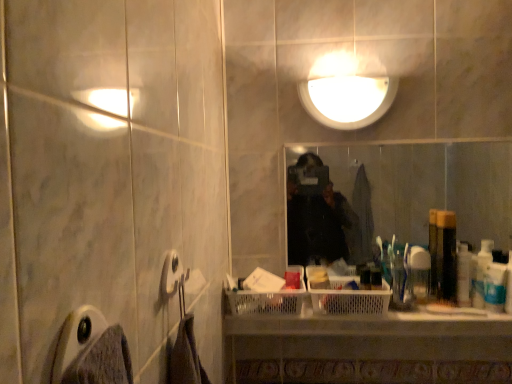
What is the approximate width of white plastic toothbrush at right, which is counted as the 4th toiletry, starting from the left?

The width of white plastic toothbrush at right, which is counted as the 4th toiletry, starting from the left, is 1.53 inches.

Describe the element at coordinates (419, 272) in the screenshot. The height and width of the screenshot is (384, 512). I see `clear plastic cup at right, the 5th toiletry in the right-to-left sequence` at that location.

You are a GUI agent. You are given a task and a screenshot of the screen. Output one action in this format:
    pyautogui.click(x=<x>, y=<y>)
    Task: Click on the clear plastic mirror at center
    The width and height of the screenshot is (512, 384).
    Given the screenshot: What is the action you would take?
    pyautogui.click(x=422, y=191)

Where is `translucent plastic bottle at right, which appears as the 4th toiletry when viewed from the right`? The image size is (512, 384). translucent plastic bottle at right, which appears as the 4th toiletry when viewed from the right is located at coordinates (446, 256).

Where is `the 4th toiletry in front of the clear plastic mirror at center`? This screenshot has height=384, width=512. the 4th toiletry in front of the clear plastic mirror at center is located at coordinates (495, 287).

Is the position of clear plastic mirror at center less distant than that of white plastic bottle at right, the fifth toiletry positioned from the left?

No, it is not.

Is clear plastic mirror at center far away from white plastic bottle at right, the fifth toiletry positioned from the left?

Indeed, clear plastic mirror at center is not near white plastic bottle at right, the fifth toiletry positioned from the left.

Which is correct: clear plastic mirror at center is inside white plastic bottle at right, the fifth toiletry positioned from the left, or outside of it?

clear plastic mirror at center is outside white plastic bottle at right, the fifth toiletry positioned from the left.

Looking at the image, does white plastic bottle at right, which is the first toiletry in right-to-left order, seem bigger or smaller compared to white glossy light fixture at upper center?

white plastic bottle at right, which is the first toiletry in right-to-left order, is smaller than white glossy light fixture at upper center.

I want to click on the 3rd toiletry in front of the white glossy light fixture at upper center, counting from the anchor's position, so click(x=495, y=287).

Can you confirm if white plastic bottle at right, the fifth toiletry positioned from the left, is thinner than white glossy light fixture at upper center?

Correct, the width of white plastic bottle at right, the fifth toiletry positioned from the left, is less than that of white glossy light fixture at upper center.

From the image's perspective, between white plastic bottle at right, which is the first toiletry in right-to-left order, and white glossy light fixture at upper center, who is located below?

white plastic bottle at right, which is the first toiletry in right-to-left order.

Considering the relative sizes of translucent plastic bottle at right, the 2th toiletry from the left, and translucent plastic bottle at right, which appears as the third toiletry when viewed from the right, in the image provided, is translucent plastic bottle at right, the 2th toiletry from the left, bigger than translucent plastic bottle at right, which appears as the third toiletry when viewed from the right,?

Yes, translucent plastic bottle at right, the 2th toiletry from the left, is bigger than translucent plastic bottle at right, which appears as the third toiletry when viewed from the right.

Which object is further away from the camera, translucent plastic bottle at right, which appears as the 4th toiletry when viewed from the right, or translucent plastic bottle at right, arranged as the third toiletry when viewed from the left?

translucent plastic bottle at right, arranged as the third toiletry when viewed from the left, is further from the camera.

Is translucent plastic bottle at right, arranged as the third toiletry when viewed from the left, completely or partially inside translucent plastic bottle at right, the 2th toiletry from the left?

No, translucent plastic bottle at right, arranged as the third toiletry when viewed from the left, is not a part of translucent plastic bottle at right, the 2th toiletry from the left.

From the picture: From the image's perspective, which is below, white plastic toothbrush at right, which is counted as the 4th toiletry, starting from the left, or clear plastic cup at right, the first toiletry viewed from the left?

white plastic toothbrush at right, which is counted as the 4th toiletry, starting from the left.

In the scene shown: In terms of width, does white plastic toothbrush at right, which ranks as the 2th toiletry in right-to-left order, look wider or thinner when compared to clear plastic cup at right, the first toiletry viewed from the left?

Considering their sizes, white plastic toothbrush at right, which ranks as the 2th toiletry in right-to-left order, looks slimmer than clear plastic cup at right, the first toiletry viewed from the left.

Is white plastic toothbrush at right, which is counted as the 4th toiletry, starting from the left, far away from clear plastic cup at right, the first toiletry viewed from the left?

No, white plastic toothbrush at right, which is counted as the 4th toiletry, starting from the left, is not far from clear plastic cup at right, the first toiletry viewed from the left.

Looking at this image, from a real-world perspective, is white plastic toothbrush at right, which ranks as the 2th toiletry in right-to-left order, above or below clear plastic cup at right, the 5th toiletry in the right-to-left sequence?

white plastic toothbrush at right, which ranks as the 2th toiletry in right-to-left order, is below clear plastic cup at right, the 5th toiletry in the right-to-left sequence.

Could translucent plastic bottle at right, which appears as the third toiletry when viewed from the right, be considered to be inside clear plastic mirror at center?

No, translucent plastic bottle at right, which appears as the third toiletry when viewed from the right, is located outside of clear plastic mirror at center.

Is clear plastic mirror at center placed right next to translucent plastic bottle at right, which appears as the third toiletry when viewed from the right?

clear plastic mirror at center and translucent plastic bottle at right, which appears as the third toiletry when viewed from the right, are clearly separated.

Is clear plastic mirror at center shorter than translucent plastic bottle at right, which appears as the third toiletry when viewed from the right?

Incorrect, the height of clear plastic mirror at center does not fall short of that of translucent plastic bottle at right, which appears as the third toiletry when viewed from the right.

From a real-world perspective, is translucent plastic bottle at right, which appears as the third toiletry when viewed from the right, over translucent plastic bottle at right, the 2th toiletry from the left?

No, from a real-world perspective, translucent plastic bottle at right, which appears as the third toiletry when viewed from the right, is not over translucent plastic bottle at right, the 2th toiletry from the left

Is there a large distance between translucent plastic bottle at right, arranged as the third toiletry when viewed from the left, and translucent plastic bottle at right, the 2th toiletry from the left?

That's not correct — translucent plastic bottle at right, arranged as the third toiletry when viewed from the left, is a little close to translucent plastic bottle at right, the 2th toiletry from the left.

Would you say translucent plastic bottle at right, which appears as the third toiletry when viewed from the right, is outside translucent plastic bottle at right, which appears as the 4th toiletry when viewed from the right?

Yes, translucent plastic bottle at right, which appears as the third toiletry when viewed from the right, is not within translucent plastic bottle at right, which appears as the 4th toiletry when viewed from the right.

Is gray fabric towel bar at lower left situated inside white glossy light fixture at upper center or outside?

gray fabric towel bar at lower left exists outside the volume of white glossy light fixture at upper center.

You are a GUI agent. You are given a task and a screenshot of the screen. Output one action in this format:
    pyautogui.click(x=<x>, y=<y>)
    Task: Click on the light fixture that appears behind the gray fabric towel bar at lower left
    The image size is (512, 384).
    Given the screenshot: What is the action you would take?
    pyautogui.click(x=348, y=100)

Is gray fabric towel bar at lower left bigger than white glossy light fixture at upper center?

No, gray fabric towel bar at lower left is not bigger than white glossy light fixture at upper center.

Is gray fabric towel bar at lower left facing away from white glossy light fixture at upper center?

No, gray fabric towel bar at lower left's orientation is not away from white glossy light fixture at upper center.

Where is `mirror to the left of white plastic bottle at right, the fifth toiletry positioned from the left`? The image size is (512, 384). mirror to the left of white plastic bottle at right, the fifth toiletry positioned from the left is located at coordinates (422, 191).

Where is `light fixture positioned vertically above the white plastic bottle at right, the fifth toiletry positioned from the left (from a real-world perspective)`? This screenshot has width=512, height=384. light fixture positioned vertically above the white plastic bottle at right, the fifth toiletry positioned from the left (from a real-world perspective) is located at coordinates (348, 100).

Looking at the image, which one is located further to white plastic bottle at right, which is the first toiletry in right-to-left order, translucent plastic bottle at right, which appears as the third toiletry when viewed from the right, or translucent plastic bottle at right, the 2th toiletry from the left?

translucent plastic bottle at right, the 2th toiletry from the left.

Looking at the image, which one is located further to white plastic bottle at right, which is the first toiletry in right-to-left order, white glossy light fixture at upper center or translucent plastic bottle at right, arranged as the third toiletry when viewed from the left?

white glossy light fixture at upper center lies further to white plastic bottle at right, which is the first toiletry in right-to-left order, than the other object.

Based on their spatial positions, is white glossy light fixture at upper center or gray fabric towel bar at lower left further from translucent plastic bottle at right, the 2th toiletry from the left?

gray fabric towel bar at lower left is positioned further to the anchor translucent plastic bottle at right, the 2th toiletry from the left.

Looking at the image, which one is located closer to white plastic toothbrush at right, which ranks as the 2th toiletry in right-to-left order, gray fabric towel bar at lower left or clear plastic mirror at center?

gray fabric towel bar at lower left lies closer to white plastic toothbrush at right, which ranks as the 2th toiletry in right-to-left order, than the other object.

Estimate the real-world distances between objects in this image. Which object is closer to white plastic bottle at right, the fifth toiletry positioned from the left, gray fabric towel bar at lower left or white plastic toothbrush at right, which is counted as the 4th toiletry, starting from the left?

white plastic toothbrush at right, which is counted as the 4th toiletry, starting from the left, is positioned closer to the anchor white plastic bottle at right, the fifth toiletry positioned from the left.

Which object lies nearer to the anchor point white plastic bottle at right, which is the first toiletry in right-to-left order, translucent plastic bottle at right, arranged as the third toiletry when viewed from the left, or clear plastic cup at right, the first toiletry viewed from the left?

Based on the image, translucent plastic bottle at right, arranged as the third toiletry when viewed from the left, appears to be nearer to white plastic bottle at right, which is the first toiletry in right-to-left order.

When comparing their distances from white plastic bottle at right, which is the first toiletry in right-to-left order, does translucent plastic bottle at right, which appears as the 4th toiletry when viewed from the right, or clear plastic cup at right, the 5th toiletry in the right-to-left sequence, seem closer?

translucent plastic bottle at right, which appears as the 4th toiletry when viewed from the right, is closer to white plastic bottle at right, which is the first toiletry in right-to-left order.

Estimate the real-world distances between objects in this image. Which object is further from translucent plastic bottle at right, which appears as the 4th toiletry when viewed from the right, gray fabric towel bar at lower left or white plastic bottle at right, the fifth toiletry positioned from the left?

Among the two, gray fabric towel bar at lower left is located further to translucent plastic bottle at right, which appears as the 4th toiletry when viewed from the right.

Locate an element on the screen. The width and height of the screenshot is (512, 384). toiletry between white glossy light fixture at upper center and translucent plastic bottle at right, arranged as the third toiletry when viewed from the left, in the vertical direction is located at coordinates (446, 256).

What are the coordinates of `toiletry between clear plastic cup at right, the 5th toiletry in the right-to-left sequence, and translucent plastic bottle at right, arranged as the third toiletry when viewed from the left, from left to right` in the screenshot? It's located at (446, 256).

Locate an element on the screen. The image size is (512, 384). mirror located between gray fabric towel bar at lower left and clear plastic cup at right, the 5th toiletry in the right-to-left sequence, in the depth direction is located at coordinates (422, 191).

Where is `mirror between white glossy light fixture at upper center and clear plastic cup at right, the first toiletry viewed from the left, in the up-down direction`? This screenshot has width=512, height=384. mirror between white glossy light fixture at upper center and clear plastic cup at right, the first toiletry viewed from the left, in the up-down direction is located at coordinates (422, 191).